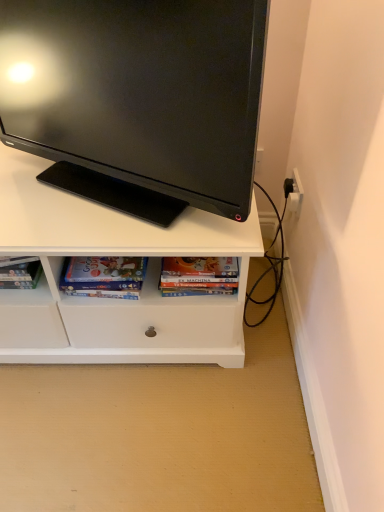
Where is `hardcover book at center, the second book positioned from the left`? The height and width of the screenshot is (512, 384). hardcover book at center, the second book positioned from the left is located at coordinates (199, 275).

Is matte black monitor at upper center next to hardcover book at center, the second book positioned from the left?

No, matte black monitor at upper center is not in contact with hardcover book at center, the second book positioned from the left.

Consider the image. From the image's perspective, who appears lower, matte black monitor at upper center or hardcover book at center, the second book positioned from the left?

hardcover book at center, the second book positioned from the left, appears lower in the image.

Is hardcover book at center, the second book positioned from the left, aimed at matte cardboard book at lower center, which is the second book from right to left?

No, hardcover book at center, the second book positioned from the left, does not turn towards matte cardboard book at lower center, which is the second book from right to left.

How different are the orientations of hardcover book at center, acting as the 1th book starting from the right, and matte cardboard book at lower center, the first book from the left, in degrees?

The facing directions of hardcover book at center, acting as the 1th book starting from the right, and matte cardboard book at lower center, the first book from the left, are 6.15 degrees apart.

From a real-world perspective, does hardcover book at center, acting as the 1th book starting from the right, stand above matte cardboard book at lower center, the first book from the left?

Incorrect, from a real-world perspective, hardcover book at center, acting as the 1th book starting from the right, is lower than matte cardboard book at lower center, the first book from the left.

How far apart are hardcover book at center, acting as the 1th book starting from the right, and matte cardboard book at lower center, the first book from the left?

hardcover book at center, acting as the 1th book starting from the right, is 5.83 inches away from matte cardboard book at lower center, the first book from the left.

Locate an element on the screen. book that is the 2nd object located below the matte black monitor at upper center (from the image's perspective) is located at coordinates (103, 276).

From the picture: How far apart are matte black monitor at upper center and matte cardboard book at lower center, the first book from the left?

matte black monitor at upper center and matte cardboard book at lower center, the first book from the left, are 13.87 inches apart.

Between matte black monitor at upper center and matte cardboard book at lower center, which is the second book from right to left, which one has less height?

Standing shorter between the two is matte cardboard book at lower center, which is the second book from right to left.

In terms of width, does matte black monitor at upper center look wider or thinner when compared to matte cardboard book at lower center, the first book from the left?

matte black monitor at upper center is wider than matte cardboard book at lower center, the first book from the left.

Which object is closer to the camera, hardcover book at center, the second book positioned from the left, or matte black monitor at upper center?

matte black monitor at upper center.

Considering the relative sizes of hardcover book at center, the second book positioned from the left, and matte black monitor at upper center in the image provided, is hardcover book at center, the second book positioned from the left, bigger than matte black monitor at upper center?

Incorrect, hardcover book at center, the second book positioned from the left, is not larger than matte black monitor at upper center.

Between matte cardboard book at lower center, which is the second book from right to left, and matte black monitor at upper center, which one has larger size?

Bigger between the two is matte black monitor at upper center.

From their relative heights in the image, would you say matte cardboard book at lower center, the first book from the left, is taller or shorter than matte black monitor at upper center?

Clearly, matte cardboard book at lower center, the first book from the left, is shorter compared to matte black monitor at upper center.

Is matte cardboard book at lower center, the first book from the left, oriented towards matte black monitor at upper center?

No, matte cardboard book at lower center, the first book from the left, does not turn towards matte black monitor at upper center.

Considering the points (85, 293) and (189, 280), which point is behind, point (85, 293) or point (189, 280)?

The point (85, 293) is behind.

Is the surface of matte cardboard book at lower center, which is the second book from right to left, in direct contact with hardcover book at center, the second book positioned from the left?

No, matte cardboard book at lower center, which is the second book from right to left, is not making contact with hardcover book at center, the second book positioned from the left.

From a real-world perspective, which object rests below the other?

From a 3D spatial view, hardcover book at center, acting as the 1th book starting from the right, is below.

How distant is matte cardboard book at lower center, which is the second book from right to left, from hardcover book at center, acting as the 1th book starting from the right?

A distance of 5.83 inches exists between matte cardboard book at lower center, which is the second book from right to left, and hardcover book at center, acting as the 1th book starting from the right.

I want to click on book on the right of matte black monitor at upper center, so click(199, 275).

This screenshot has height=512, width=384. What are the coordinates of `book below the matte cardboard book at lower center, which is the second book from right to left (from a real-world perspective)` in the screenshot? It's located at (199, 275).

When comparing their distances from matte cardboard book at lower center, which is the second book from right to left, does hardcover book at center, the second book positioned from the left, or matte black monitor at upper center seem further?

The object further to matte cardboard book at lower center, which is the second book from right to left, is matte black monitor at upper center.

Looking at the image, which one is located closer to matte black monitor at upper center, matte cardboard book at lower center, the first book from the left, or hardcover book at center, acting as the 1th book starting from the right?

The object closer to matte black monitor at upper center is matte cardboard book at lower center, the first book from the left.

Considering their positions, is hardcover book at center, the second book positioned from the left, positioned closer to matte black monitor at upper center than matte cardboard book at lower center, which is the second book from right to left?

matte cardboard book at lower center, which is the second book from right to left, lies closer to matte black monitor at upper center than the other object.

Estimate the real-world distances between objects in this image. Which object is closer to matte cardboard book at lower center, which is the second book from right to left, matte black monitor at upper center or hardcover book at center, the second book positioned from the left?

The object closer to matte cardboard book at lower center, which is the second book from right to left, is hardcover book at center, the second book positioned from the left.

Looking at this image, looking at the image, which one is located further to hardcover book at center, acting as the 1th book starting from the right, matte black monitor at upper center or matte cardboard book at lower center, the first book from the left?

matte black monitor at upper center lies further to hardcover book at center, acting as the 1th book starting from the right, than the other object.

Which object lies nearer to the anchor point hardcover book at center, acting as the 1th book starting from the right, matte cardboard book at lower center, the first book from the left, or matte black monitor at upper center?

The object closer to hardcover book at center, acting as the 1th book starting from the right, is matte cardboard book at lower center, the first book from the left.

Locate an element on the screen. This screenshot has height=512, width=384. book between matte black monitor at upper center and hardcover book at center, the second book positioned from the left, from front to back is located at coordinates (103, 276).